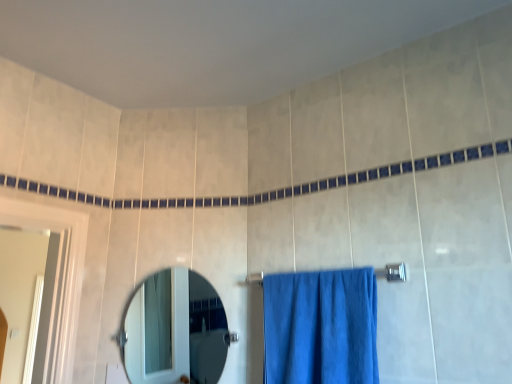
Question: Does silver metallic towel bar at center appear on the left side of blue fabric towel at center?

Choices:
 (A) yes
 (B) no

Answer: (B)

Question: Is the position of silver metallic towel bar at center more distant than that of blue fabric towel at center?

Choices:
 (A) no
 (B) yes

Answer: (B)

Question: Is silver metallic towel bar at center positioned with its back to blue fabric towel at center?

Choices:
 (A) no
 (B) yes

Answer: (B)

Question: From a real-world perspective, is silver metallic towel bar at center positioned over blue fabric towel at center based on gravity?

Choices:
 (A) yes
 (B) no

Answer: (A)

Question: From the image's perspective, is silver metallic towel bar at center beneath blue fabric towel at center?

Choices:
 (A) no
 (B) yes

Answer: (A)

Question: Is clear glass mirror at center bigger or smaller than blue fabric towel at center?

Choices:
 (A) big
 (B) small

Answer: (B)

Question: Is clear glass mirror at center spatially inside blue fabric towel at center, or outside of it?

Choices:
 (A) outside
 (B) inside

Answer: (A)

Question: Considering the positions of clear glass mirror at center and blue fabric towel at center in the image, is clear glass mirror at center taller or shorter than blue fabric towel at center?

Choices:
 (A) short
 (B) tall

Answer: (B)

Question: From a real-world perspective, relative to blue fabric towel at center, is clear glass mirror at center vertically above or below?

Choices:
 (A) above
 (B) below

Answer: (A)

Question: Based on their positions, is silver metallic towel bar at center located to the left or right of blue fabric towel at center?

Choices:
 (A) right
 (B) left

Answer: (A)

Question: Is silver metallic towel bar at center bigger or smaller than blue fabric towel at center?

Choices:
 (A) big
 (B) small

Answer: (B)

Question: Looking at their shapes, would you say silver metallic towel bar at center is wider or thinner than blue fabric towel at center?

Choices:
 (A) thin
 (B) wide

Answer: (A)

Question: Which is correct: silver metallic towel bar at center is inside blue fabric towel at center, or outside of it?

Choices:
 (A) inside
 (B) outside

Answer: (A)

Question: From their relative heights in the image, would you say silver metallic towel bar at center is taller or shorter than clear glass mirror at center?

Choices:
 (A) tall
 (B) short

Answer: (B)

Question: Would you say silver metallic towel bar at center is to the left or to the right of clear glass mirror at center in the picture?

Choices:
 (A) right
 (B) left

Answer: (A)